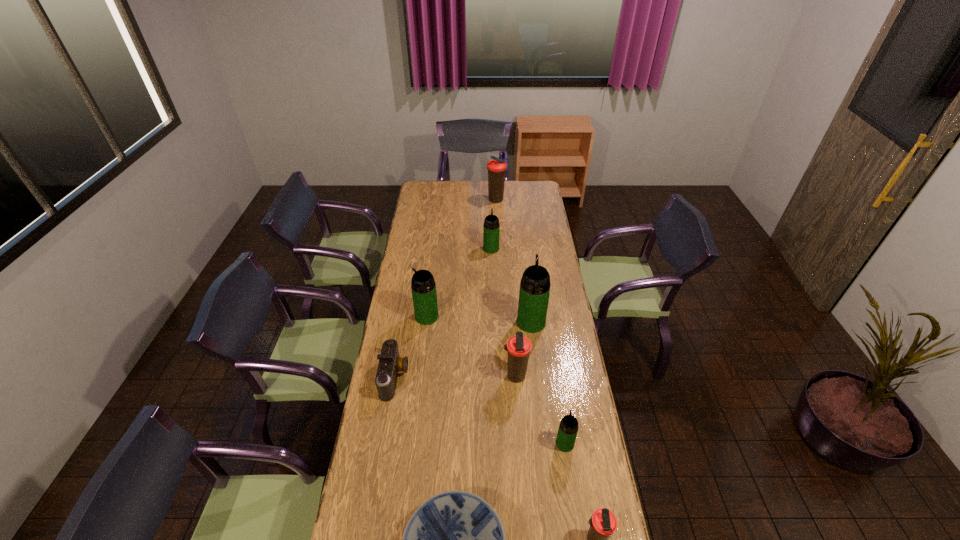
You are a GUI agent. You are given a task and a screenshot of the screen. Output one action in this format:
    pyautogui.click(x=<x>, y=<y>)
    Task: Click on the nearest green thermos bottle
    The height and width of the screenshot is (540, 960).
    Given the screenshot: What is the action you would take?
    pyautogui.click(x=568, y=428)

At what (x,y) coordinates should I click in order to perform the action: click on the third nearest object. Please return your answer as a coordinate pair (x, y). This screenshot has height=540, width=960. Looking at the image, I should click on (568, 428).

The image size is (960, 540). I want to click on camera, so click(x=390, y=363).

Identify the location of free region located from the spout of the biggest green thermos bottle. (527, 288).

I want to click on vacant space positioned 0.340m from the spout of the biggest green thermos bottle, so click(x=524, y=265).

The image size is (960, 540). I want to click on vacant region located from the spout of the biggest green thermos bottle, so click(x=524, y=262).

This screenshot has width=960, height=540. In order to click on vacant space situated on the back of the biggest brown thermos bottle in this screenshot , I will do `click(495, 180)`.

Locate an element on the screen. vacant space located 0.060m from the spout of the leftmost green thermos bottle is located at coordinates click(x=402, y=316).

The width and height of the screenshot is (960, 540). In order to click on vacant area located 0.320m from the spout of the eighth nearest object in this screenshot , I will do `click(490, 212)`.

The width and height of the screenshot is (960, 540). What are the coordinates of `free space located from the spout of the eighth nearest object` in the screenshot? It's located at (491, 231).